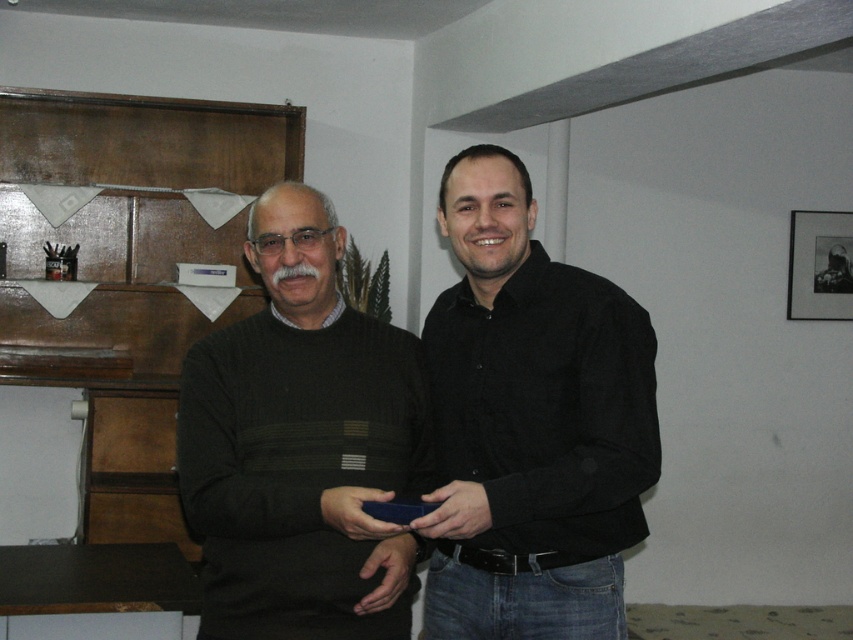
You are standing in the room and want to reach both the point at coordinates (x=357, y=554) and the point at (x=851, y=236). Which point should you reach for first if you want to touch the one closer to you first?

You should reach for point (x=357, y=554) first because it is closer to you than point (x=851, y=236).

You are a photographer who needs to capture a closeup shot of the dark green knitted sweater at left. The camera you are using has a minimum focusing distance of 5 feet. Can you take the photo without moving either the camera or the sweater?

The dark green knitted sweater at left and camera are 4.97 feet apart from each other, which is less than the camera minimum focusing distance of 5 feet. Therefore, you cannot take the photo without moving either the camera or the sweater.

You are standing in the room and want to place a small plant between the two points, point (x=514, y=294) and point (x=802, y=236). Which point should the plant be closer to in order to be in front of the other point?

The plant should be closer to point (x=514, y=294) because it is in front of point (x=802, y=236).